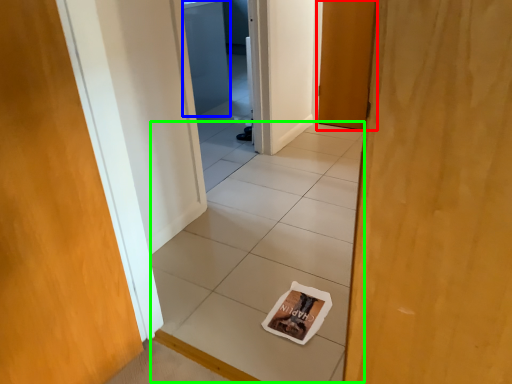
Question: Which object is the closest to the door (highlighted by a red box)? Choose among these: screen door (highlighted by a blue box) or tile (highlighted by a green box).

Choices:
 (A) screen door
 (B) tile

Answer: (B)